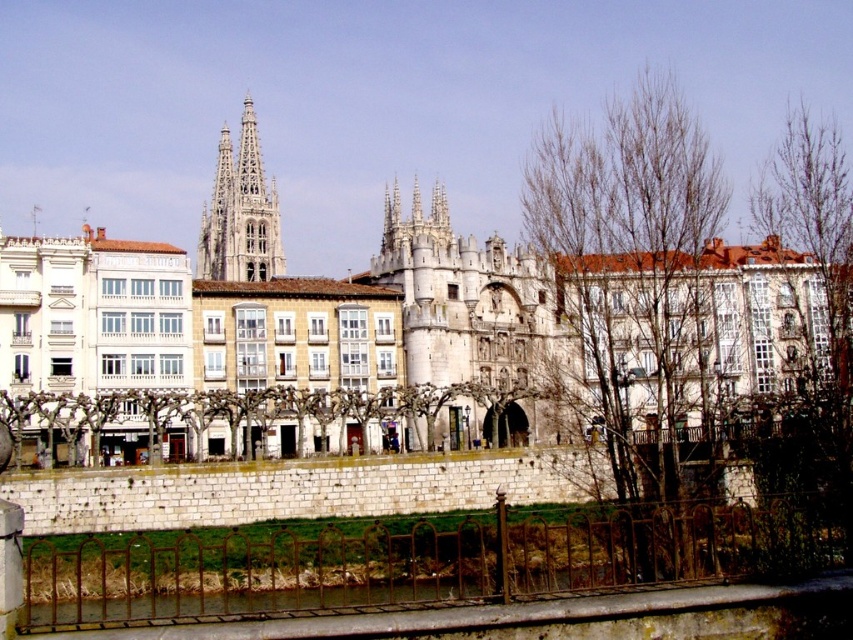
Which of these two, bare branches at center or bare branches at right, stands shorter?

bare branches at right

Who is higher up, bare branches at center or bare branches at right?

bare branches at center is higher up.

Is point (624, 360) positioned in front of point (805, 374)?

No, (624, 360) is further to viewer.

Where is `bare branches at center`? bare branches at center is located at coordinates (631, 266).

Find the location of a particular element. white stone gate at center is located at coordinates (447, 314).

Which is more to the right, white stone gate at center or smooth stone spire at center?

From the viewer's perspective, white stone gate at center appears more on the right side.

I want to click on white stone gate at center, so click(x=447, y=314).

Who is positioned more to the left, bare branches at right or white stone tower at upper left?

white stone tower at upper left is more to the left.

Describe the element at coordinates (817, 289) in the screenshot. Image resolution: width=853 pixels, height=640 pixels. I see `bare branches at right` at that location.

Between point (842, 184) and point (260, 275), which one is positioned behind?

Point (260, 275)

This screenshot has width=853, height=640. What are the coordinates of `bare branches at right` in the screenshot? It's located at pos(817,289).